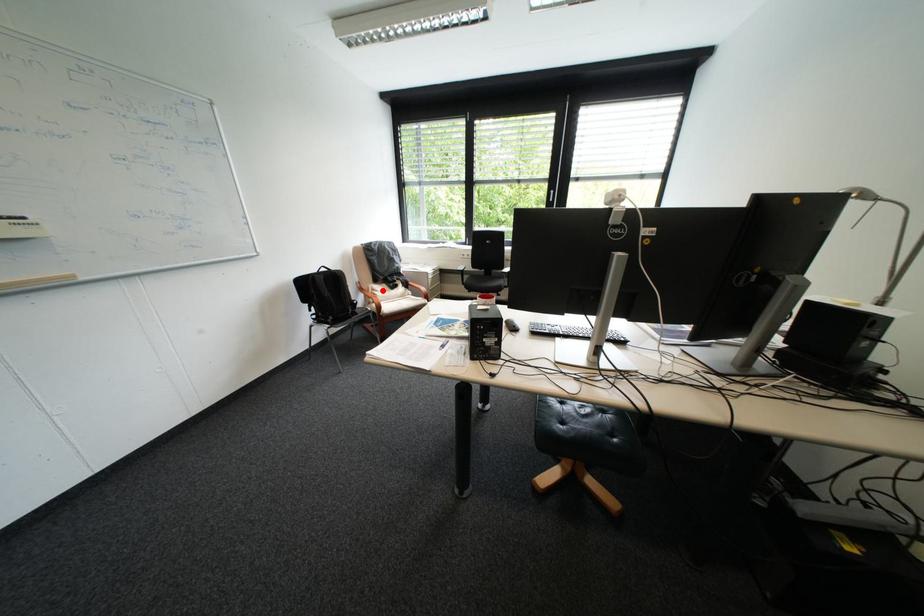
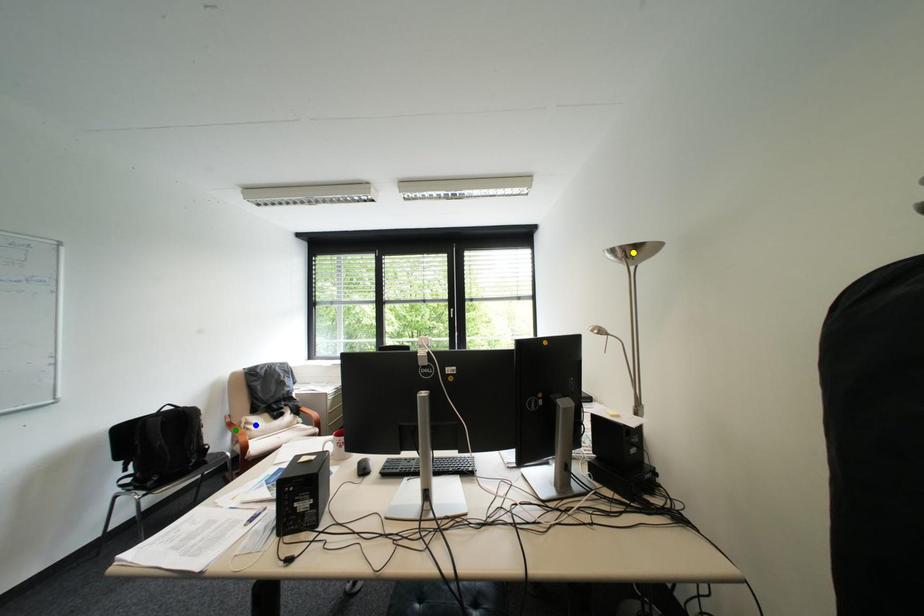
Question: I am providing you with two images of the same scene from different viewpoints. A red point is marked on the first image. You are given multiple points on the second image. Can you choose the point in image 2 that corresponds to the point in image 1?

Choices:
 (A) yellow point
 (B) blue point
 (C) green point

Answer: (B)